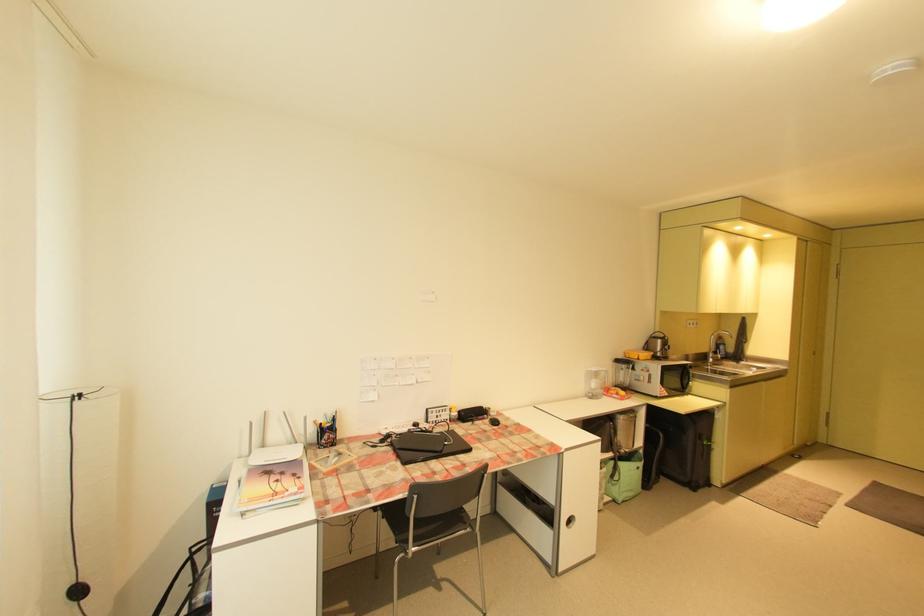
Identify the location of green tote bag. Image resolution: width=924 pixels, height=616 pixels. (624, 476).